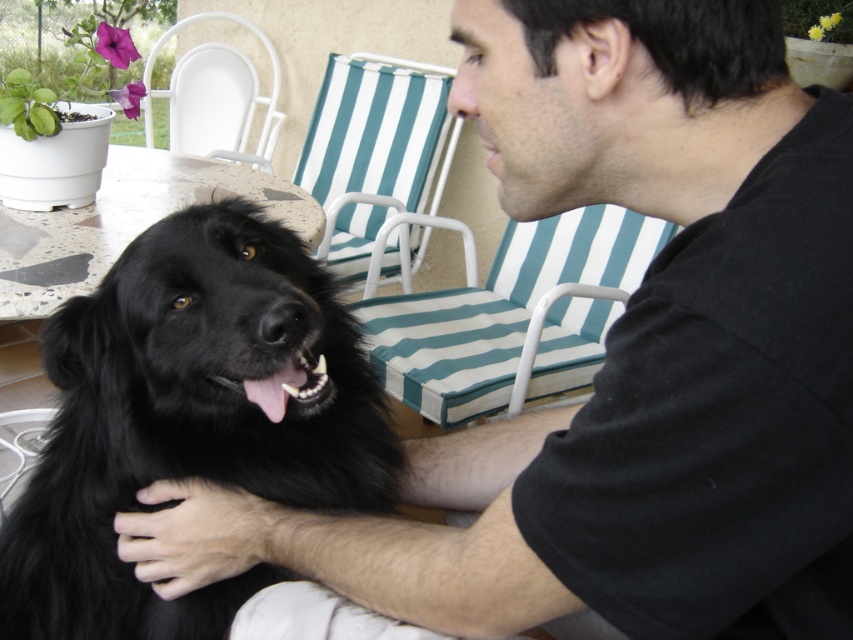
Question: Does teal striped cushion at center lie behind white plastic chair at upper left?

Choices:
 (A) yes
 (B) no

Answer: (B)

Question: Which of the following is the closest to the observer?

Choices:
 (A) (216, 58)
 (B) (339, 166)

Answer: (B)

Question: Which object is closer to the camera taking this photo?

Choices:
 (A) teal striped fabric beach chair at upper center
 (B) white plastic chair at upper left
 (C) teal striped cushion at center

Answer: (C)

Question: Which of the following is the farthest from the observer?

Choices:
 (A) teal striped cushion at center
 (B) teal striped fabric beach chair at upper center

Answer: (B)

Question: Can you confirm if teal striped cushion at center is bigger than white plastic chair at upper left?

Choices:
 (A) no
 (B) yes

Answer: (B)

Question: Does teal striped cushion at center appear on the left side of teal striped fabric beach chair at upper center?

Choices:
 (A) no
 (B) yes

Answer: (A)